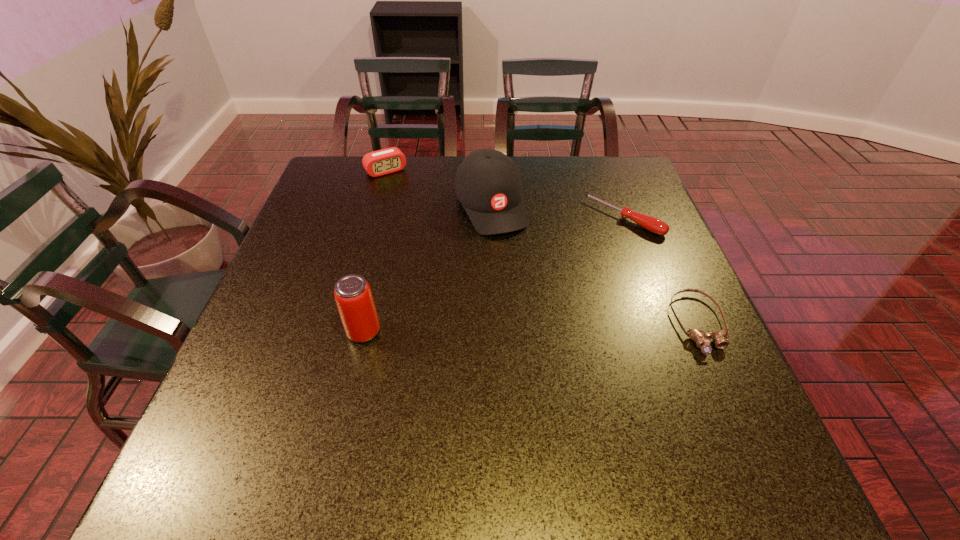
You are a GUI agent. You are given a task and a screenshot of the screen. Output one action in this format:
    pyautogui.click(x=<x>, y=<y>)
    Task: Click on the blank space at the far right corner of the desktop
    This screenshot has width=960, height=540.
    Given the screenshot: What is the action you would take?
    pyautogui.click(x=622, y=188)

This screenshot has width=960, height=540. I want to click on free space between the baseball cap and the alarm clock, so click(x=438, y=188).

Locate an element on the screen. The image size is (960, 540). free point between the alarm clock and the shortest object is located at coordinates (542, 247).

What are the coordinates of `vacant region between the beer can and the third object from right to left` in the screenshot? It's located at (427, 269).

Identify the location of blank region between the shortest object and the screwdriver. (661, 271).

This screenshot has width=960, height=540. Find the location of `free spot between the beer can and the goggles`. free spot between the beer can and the goggles is located at coordinates (531, 328).

The height and width of the screenshot is (540, 960). Identify the location of vacant area that lies between the screwdriver and the third object from left to right. (557, 212).

At what (x,y) coordinates should I click in order to perform the action: click on vacant space in between the baseball cap and the goggles. Please return your answer as a coordinate pair (x, y). The width and height of the screenshot is (960, 540). Looking at the image, I should click on (594, 265).

The image size is (960, 540). I want to click on empty space between the alarm clock and the beer can, so click(374, 251).

At what (x,y) coordinates should I click in order to perform the action: click on vacant area between the second shortest object and the third object from left to right. Please return your answer as a coordinate pair (x, y). The image size is (960, 540). Looking at the image, I should click on (557, 212).